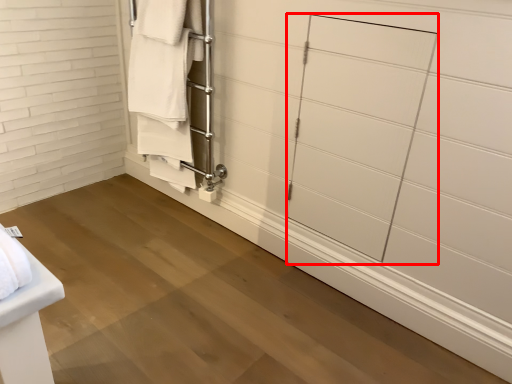
Question: From the image's perspective, where is glass door (annotated by the red box) located relative to closet?

Choices:
 (A) above
 (B) below

Answer: (B)